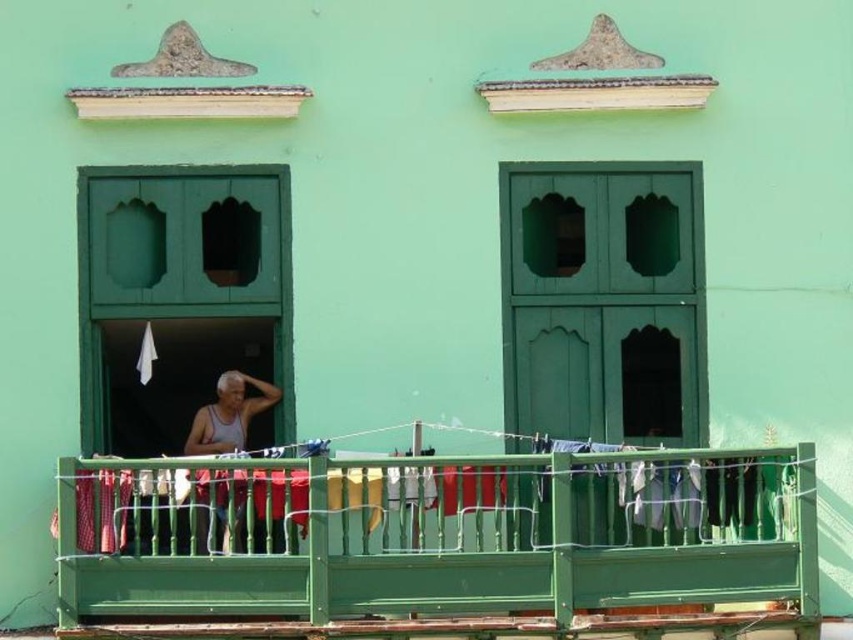
You are standing on the balcony of the building and want to hang a towel on the clothesline. There are two points marked on the clothesline at coordinates point (740, 472) and point (247, 426). Which point is closer to you when facing the balcony?

Point (740, 472) is in front of point (247, 426), so when facing the balcony, point (740, 472) is closer to you.

You are standing 13.10 meters away from the green wooden railing at center. If you want to throw a small ball to hit the railing, will you be able to reach it?

The green wooden railing at center is 13.10 meters away from the viewer. Since the distance is quite far, it might be challenging to accurately throw a small ball to hit the railing from that distance.

You are standing on the balcony of the building and want to hang a new towel on the clothesline. If you look towards the green wooden railing at center and the white tank top at center, which object is nearer to you?

The green wooden railing at center is closer to the viewer than the white tank top at center, so the green wooden railing at center is nearer to you.